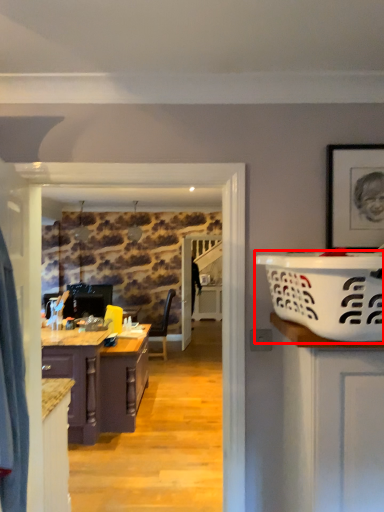
Question: From the image, what is the correct spatial relationship of basket (annotated by the red box) in relation to cabinetry?

Choices:
 (A) left
 (B) right

Answer: (B)